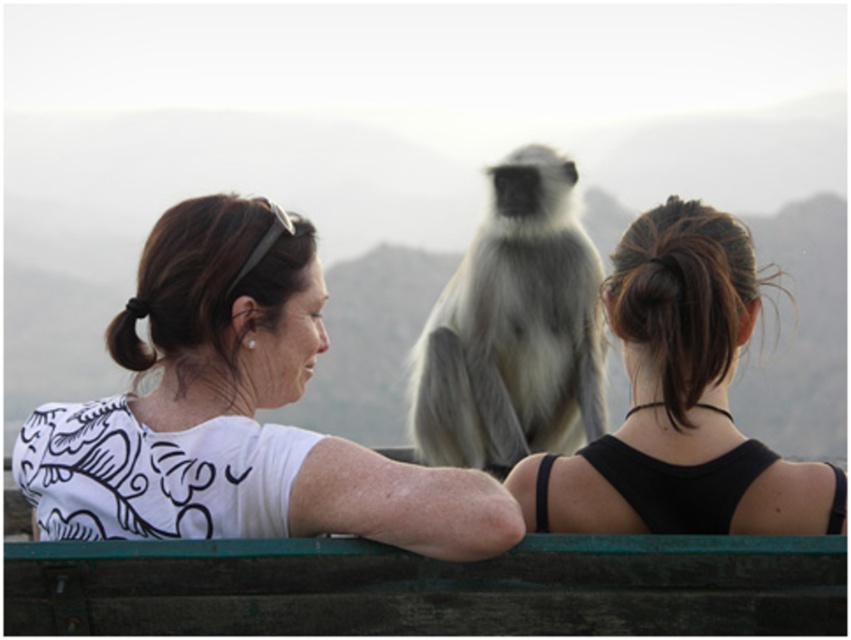
From the picture: Can you confirm if white printed shirt at left is shorter than gray furry monkey at center?

Correct, white printed shirt at left is not as tall as gray furry monkey at center.

Is point (129, 451) more distant than point (429, 333)?

No.

Who is more distant from viewer, (235,250) or (427,410)?

The point (427,410) is more distant.

Where is `white printed shirt at left`? This screenshot has width=851, height=640. white printed shirt at left is located at coordinates (235, 412).

Between white printed shirt at left and green wooden rail at lower center, which one is positioned higher?

Positioned higher is white printed shirt at left.

Which is behind, point (89, 444) or point (785, 592)?

The point (89, 444) is behind.

Locate an element on the screen. white printed shirt at left is located at coordinates (235, 412).

Is green wooden rail at lower center behind black matte ponytail at center?

No, it is in front of black matte ponytail at center.

I want to click on green wooden rail at lower center, so click(427, 588).